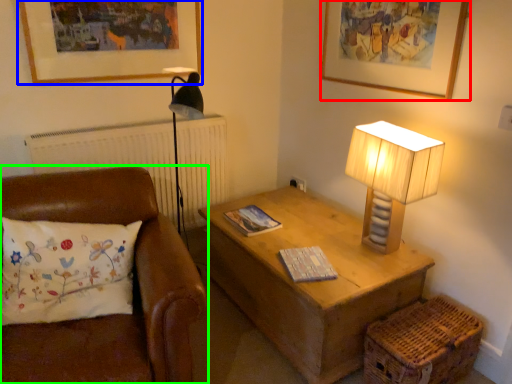
Question: Based on their relative distances, which object is nearer to picture frame (highlighted by a red box)? Choose from picture frame (highlighted by a blue box) and studio couch (highlighted by a green box).

Choices:
 (A) picture frame
 (B) studio couch

Answer: (A)